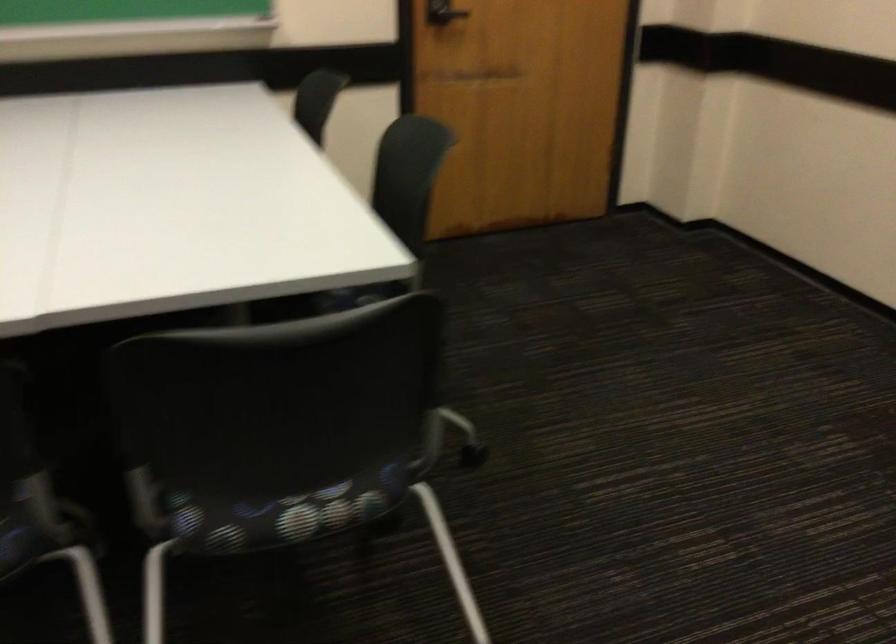
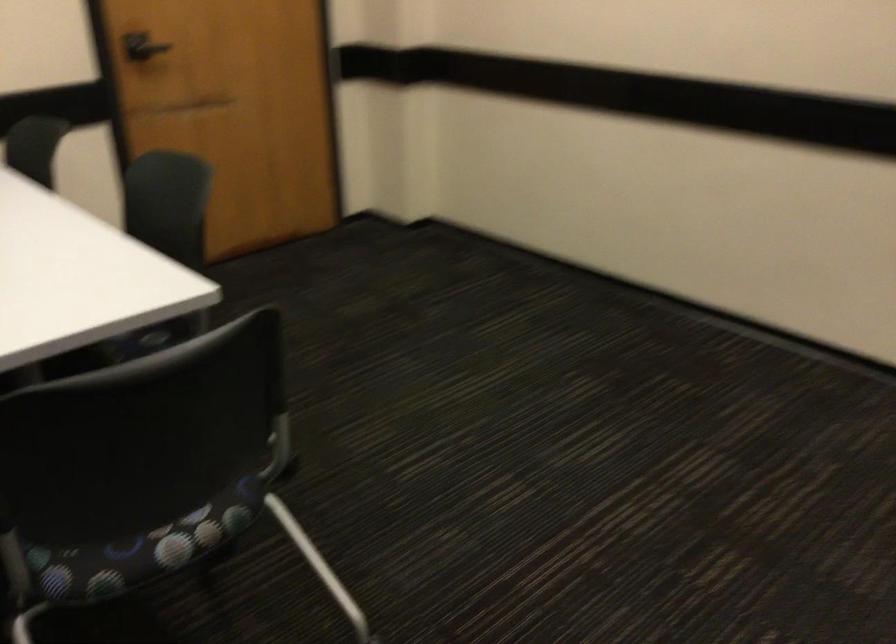
In the scene shown: Which direction would the cameraman need to move to produce the second image?

The cameraman moved toward left, backward.